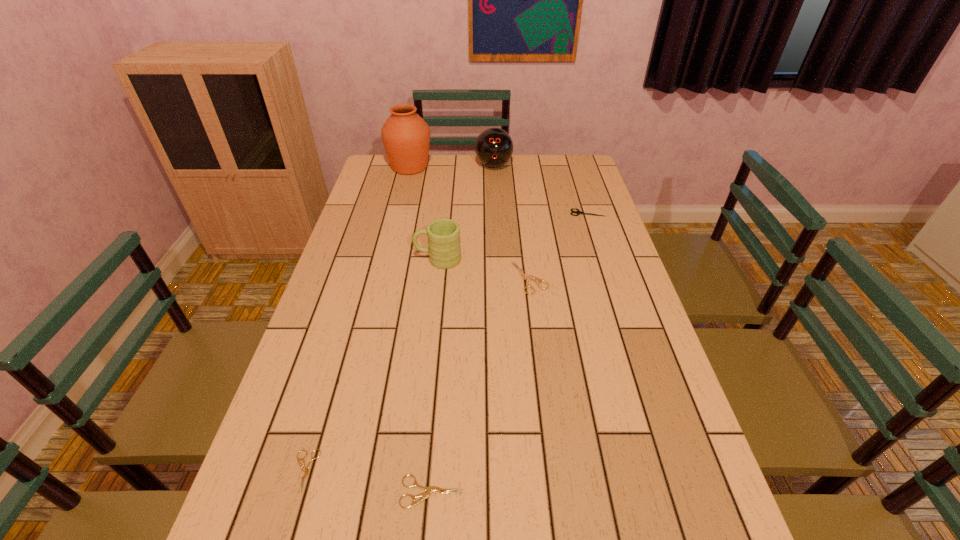
You are a GUI agent. You are given a task and a screenshot of the screen. Output one action in this format:
    pyautogui.click(x=<x>, y=<y>)
    Task: Click on the free space between the farthest beige shears and the second shears from left to right
    Image resolution: width=960 pixels, height=540 pixels.
    Given the screenshot: What is the action you would take?
    pyautogui.click(x=481, y=385)

The width and height of the screenshot is (960, 540). In order to click on object that is the second closest to the second shears from left to right in this screenshot , I will do coord(524,276).

Choose which object is the fourth nearest neighbor to the green mug. Please provide its 2D coordinates. Your answer should be formatted as a tuple, i.e. [(x, y)], where the tuple contains the x and y coordinates of a point satisfying the conditions above.

[(494, 147)]

You are a GUI agent. You are given a task and a screenshot of the screen. Output one action in this format:
    pyautogui.click(x=<x>, y=<y>)
    Task: Click on the shears identified as the third closest to the tallest object
    The height and width of the screenshot is (540, 960).
    Given the screenshot: What is the action you would take?
    pyautogui.click(x=306, y=469)

In order to click on the second closest shears to the third nearest shears in this screenshot , I will do `click(430, 489)`.

In order to click on beige shears that is the third closest to the bowling ball in this screenshot , I will do `click(430, 489)`.

Locate which beige shears is the closest to the second farthest shears. Please provide its 2D coordinates. Your answer should be formatted as a tuple, i.e. [(x, y)], where the tuple contains the x and y coordinates of a point satisfying the conditions above.

[(430, 489)]